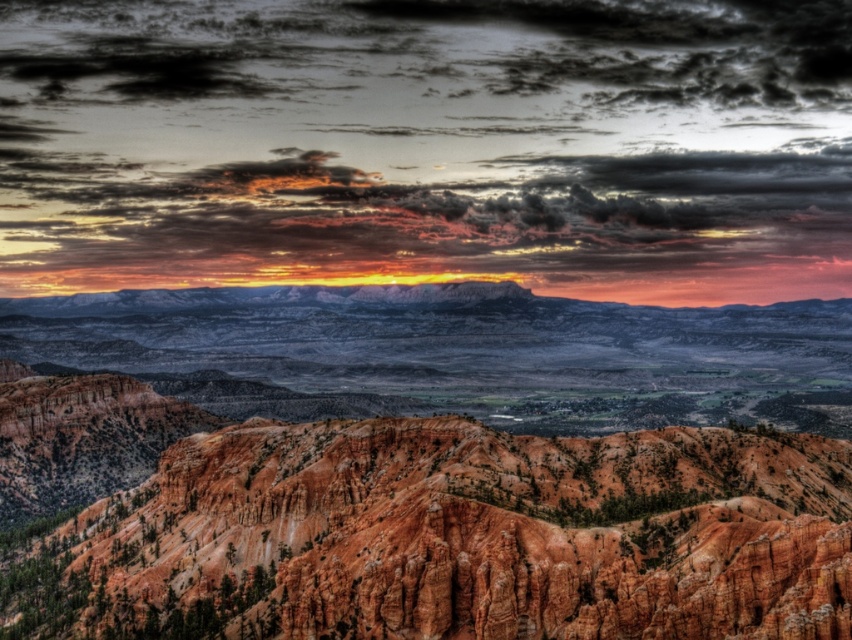
Between matte orange sky at upper center and rustic sandstone mountain at center, which one has more height?

matte orange sky at upper center is taller.

The height and width of the screenshot is (640, 852). I want to click on matte orange sky at upper center, so click(x=429, y=145).

What are the coordinates of `matte orange sky at upper center` in the screenshot? It's located at (429, 145).